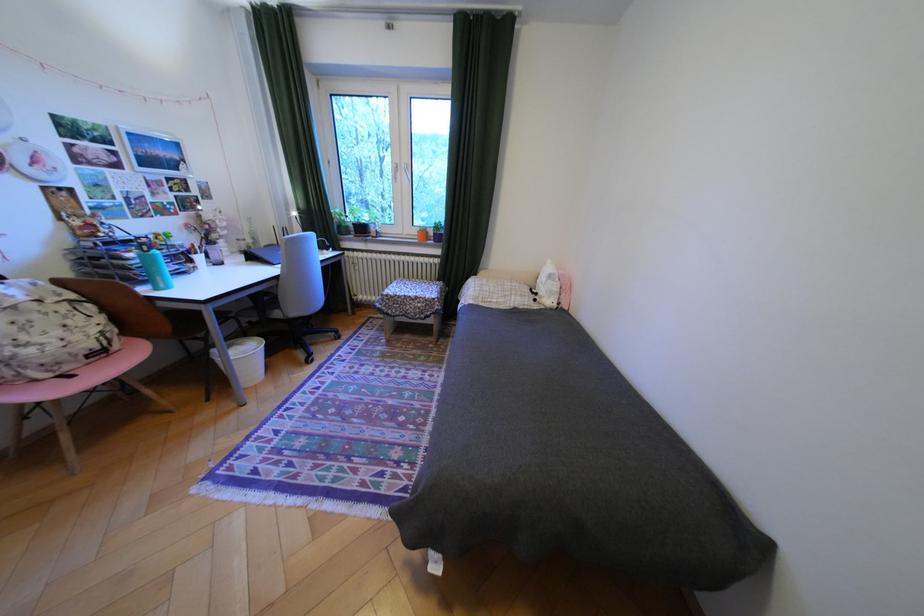
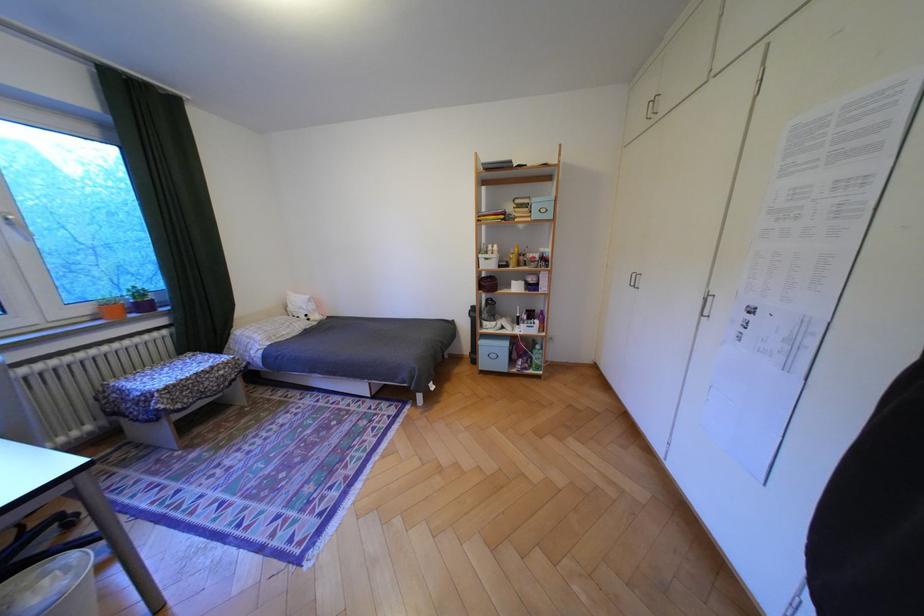
In the second image, find the point that corresponds to [450,238] in the first image.

(155, 307)